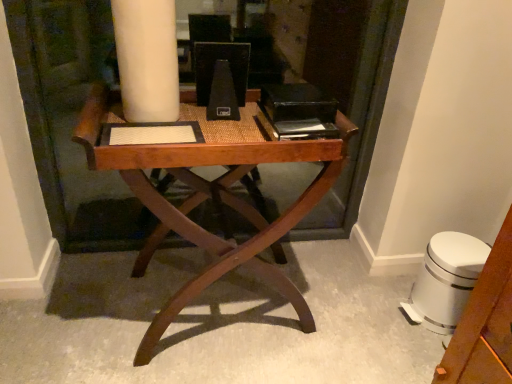
Locate an element on the screen. This screenshot has height=384, width=512. free spot to the right of wooden desk at center is located at coordinates (345, 308).